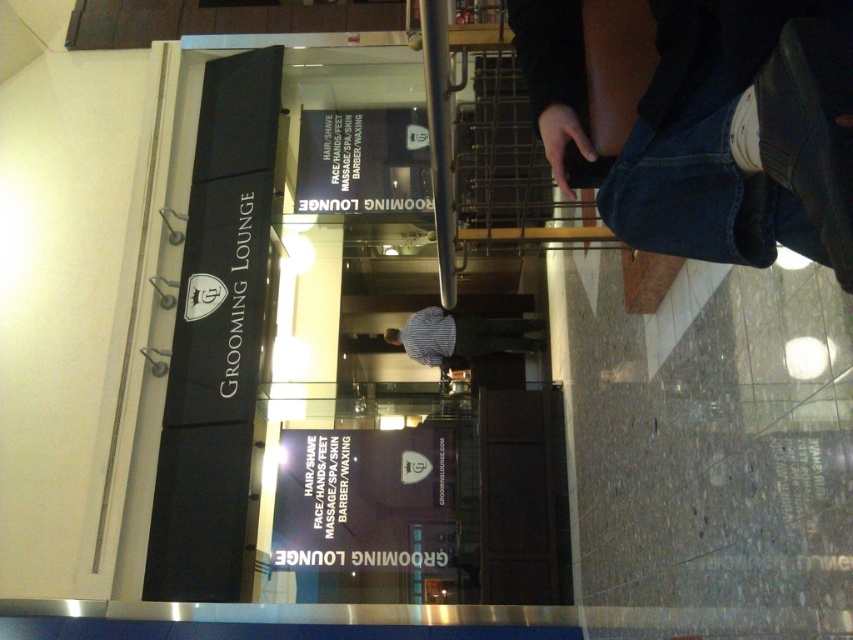
Is denim pants at lower right to the right of striped shirt at center from the viewer's perspective?

Correct, you'll find denim pants at lower right to the right of striped shirt at center.

Between denim pants at lower right and striped shirt at center, which one is positioned lower?

Positioned lower is striped shirt at center.

Is point (567, 193) behind point (490, 326)?

No, (567, 193) is in front of (490, 326).

Identify the location of denim pants at lower right. (734, 131).